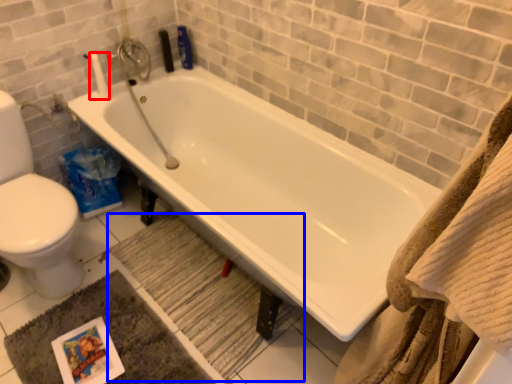
Question: Which of the following is the closest to the observer, toilet paper (highlighted by a red box) or bath mat (highlighted by a blue box)?

Choices:
 (A) toilet paper
 (B) bath mat

Answer: (B)